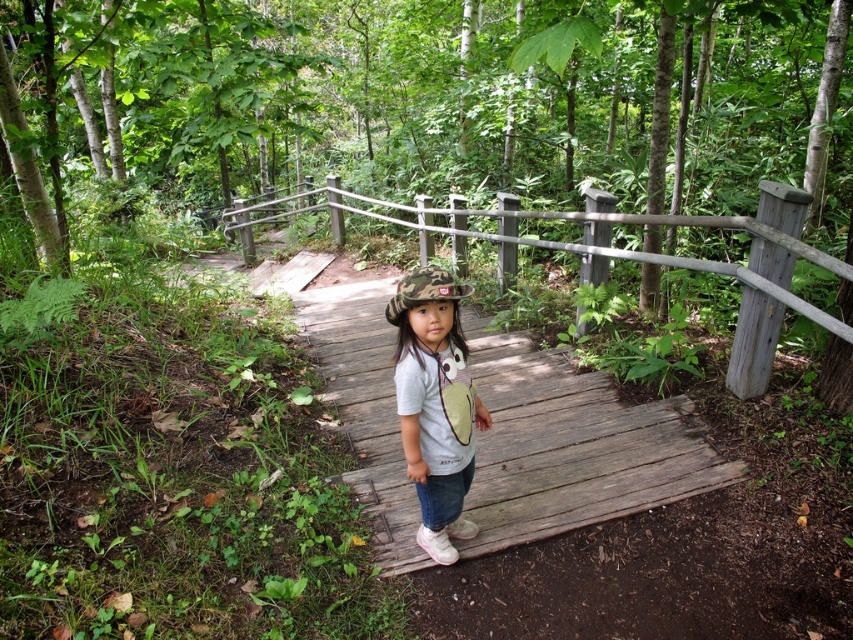
Between point (393, 288) and point (421, 291), which one is positioned behind?

The point (393, 288) is more distant.

Which is in front, point (502, 484) or point (453, 490)?

Positioned in front is point (453, 490).

The width and height of the screenshot is (853, 640). Find the location of `wooden at center`. wooden at center is located at coordinates (572, 445).

This screenshot has width=853, height=640. In order to click on wooden at center in this screenshot , I will do `click(572, 445)`.

Between point (509, 243) and point (451, 396), which one is positioned in front?

Point (451, 396) is more forward.

Is wooden rail at center closer to camera compared to camo fabric hat at center?

No.

Is point (807, 310) behind point (419, 408)?

Yes, point (807, 310) is behind point (419, 408).

Find the location of a particular element. Image resolution: width=853 pixels, height=640 pixels. wooden rail at center is located at coordinates [x=656, y=259].

Is point (544, 408) closer to viewer compared to point (726, 221)?

No, (544, 408) is further to viewer.

Consider the image. How distant is wooden at center from wooden rail at center?

wooden at center is 5.84 feet from wooden rail at center.

Is point (303, 310) positioned behind point (604, 252)?

Yes.

Find the location of a particular element. This screenshot has height=640, width=853. wooden at center is located at coordinates (572, 445).